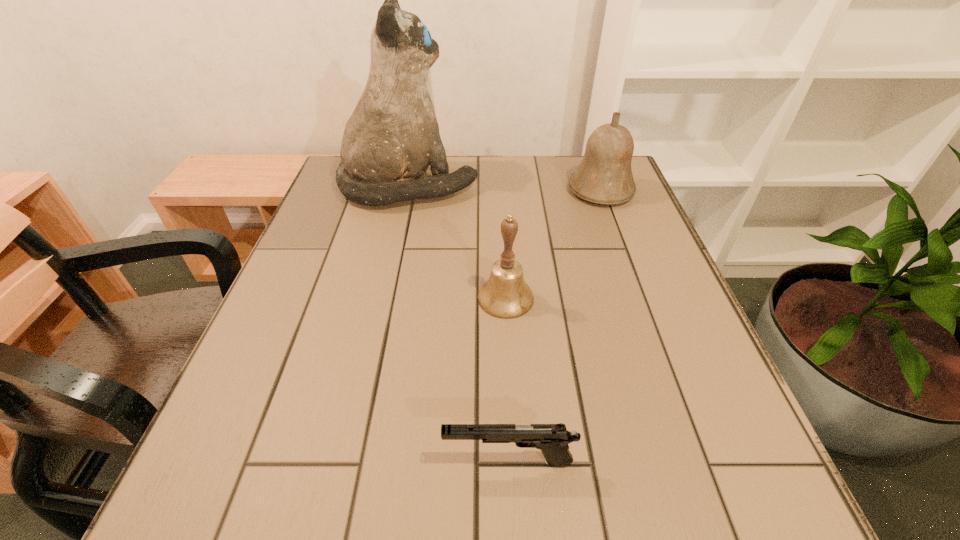
Locate an element on the screen. The image size is (960, 540). free location that satisfies the following two spatial constraints: 1. at the face of the nearer bell; 2. on the left side of the tallest object is located at coordinates (385, 298).

The width and height of the screenshot is (960, 540). I want to click on free space that satisfies the following two spatial constraints: 1. at the face of the tallest object; 2. on the back side of the left bell, so click(x=385, y=298).